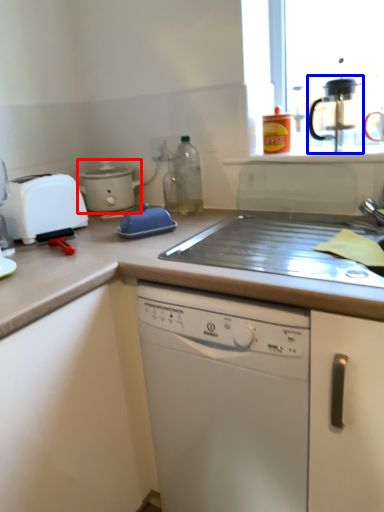
Question: Which object appears farthest to the camera in this image, kitchen appliance (highlighted by a red box) or coffee machine (highlighted by a blue box)?

Choices:
 (A) kitchen appliance
 (B) coffee machine

Answer: (A)